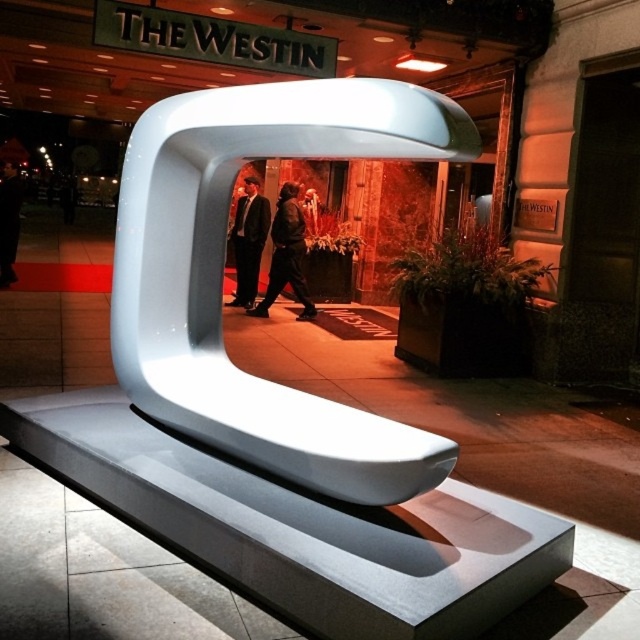
Who is more distant from viewer, (x=259, y=97) or (x=243, y=208)?

The point (x=243, y=208) is behind.

Who is more forward, [374,493] or [237,305]?

Point [374,493] is more forward.

The image size is (640, 640). In order to click on white glossy bench at center in this screenshot , I will do `click(221, 269)`.

Is dark brown leather jacket at center bigger than black leather jacket at left?

Incorrect, dark brown leather jacket at center is not larger than black leather jacket at left.

From the picture: Between dark brown leather jacket at center and black leather jacket at left, which one is positioned lower?

dark brown leather jacket at center

Who is more forward, (280, 216) or (3, 193)?

Positioned in front is point (280, 216).

Where is `dark brown leather jacket at center`? The height and width of the screenshot is (640, 640). dark brown leather jacket at center is located at coordinates (285, 253).

Which of these two, dark brown leather jacket at center or dark suit at center, stands taller?

dark suit at center is taller.

Does dark brown leather jacket at center have a larger size compared to dark suit at center?

Correct, dark brown leather jacket at center is larger in size than dark suit at center.

At what (x,y) coordinates should I click in order to perform the action: click on dark brown leather jacket at center. Please return your answer as a coordinate pair (x, y). The width and height of the screenshot is (640, 640). Looking at the image, I should click on (285, 253).

Find the location of a particular element. The image size is (640, 640). dark brown leather jacket at center is located at coordinates [x=285, y=253].